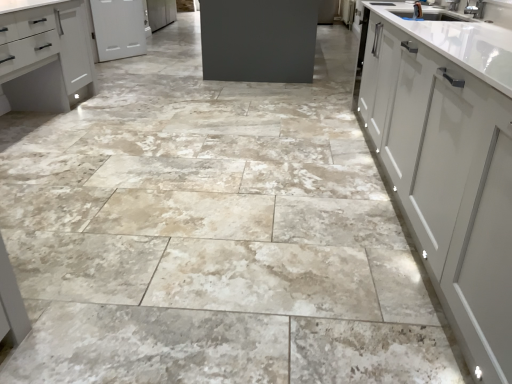
Locate an element on the screen. The width and height of the screenshot is (512, 384). free area below matte white cabinet at left, which appears as the first cabinetry when ordered from the bottom (from a real-world perspective) is located at coordinates (23, 124).